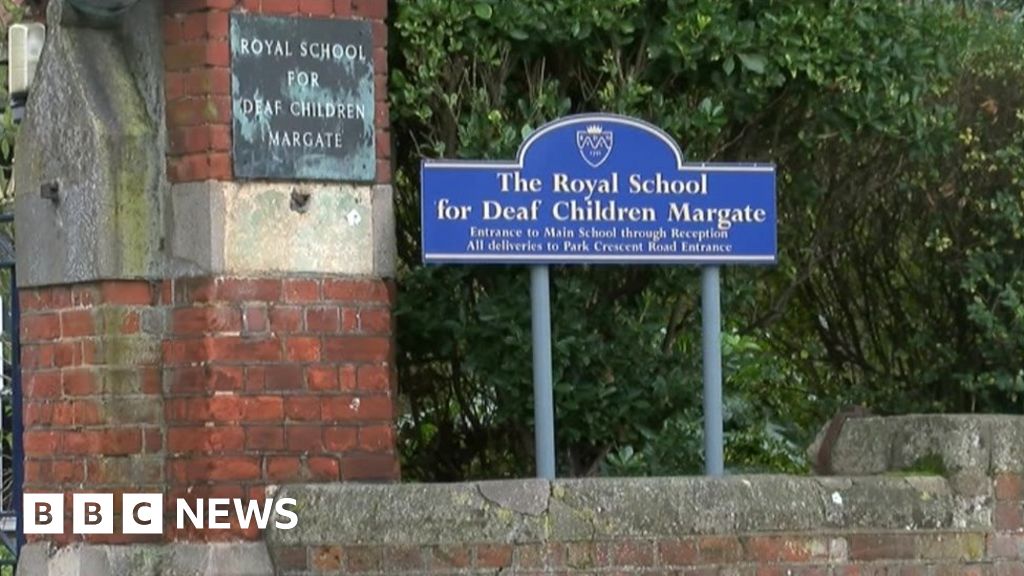
Find the location of a particular element. The image size is (1024, 576). brick wall is located at coordinates (275, 365), (63, 347).